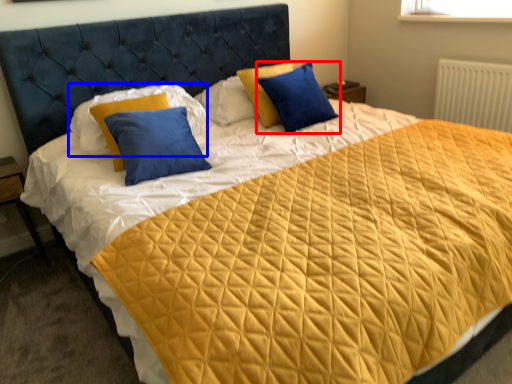
Question: Which point is further to the camera, pillow (highlighted by a red box) or pillow (highlighted by a blue box)?

Choices:
 (A) pillow
 (B) pillow

Answer: (A)